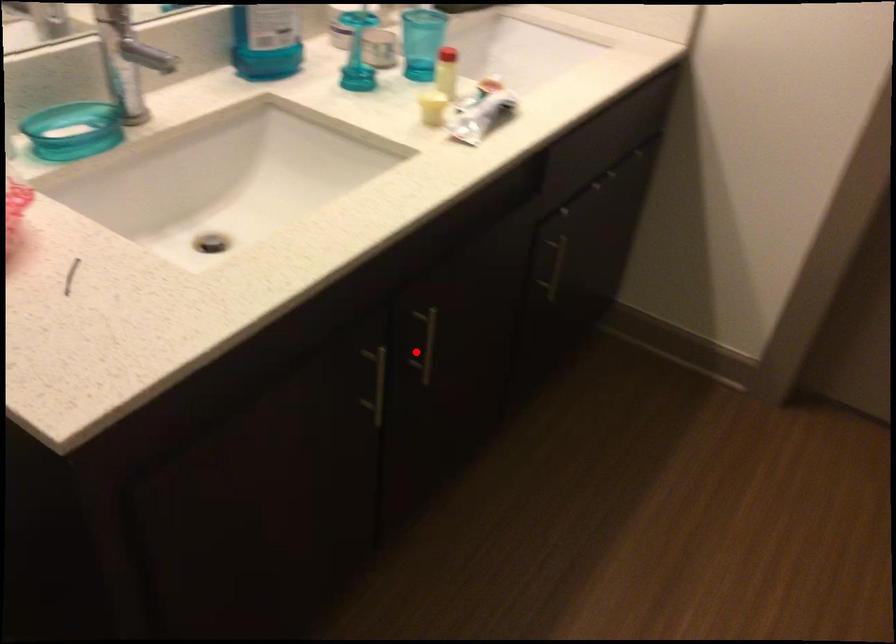
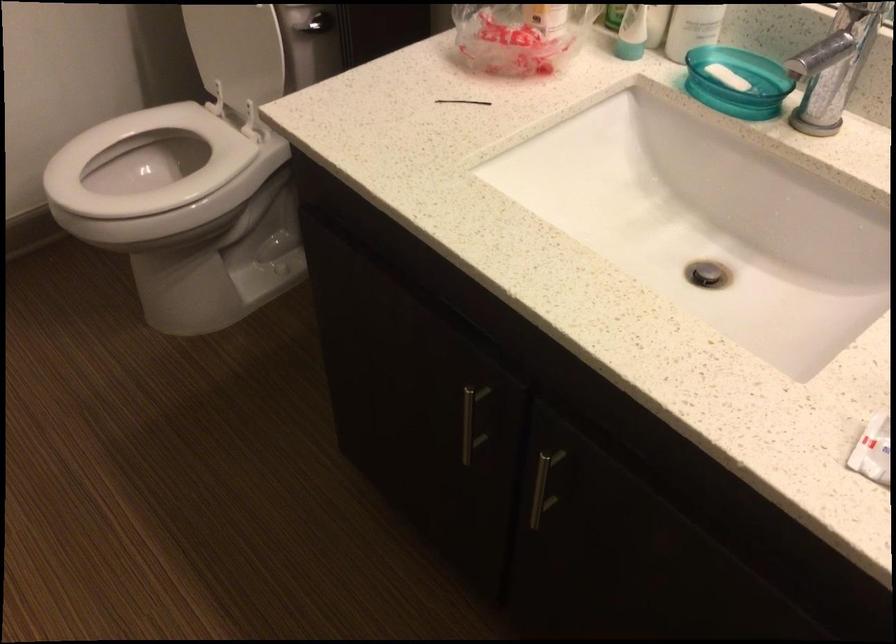
Question: I am providing you with two images of the same scene from different viewpoints. A red point is marked on the first image. Can you still see the location of the red point in image 2?

Choices:
 (A) Yes
 (B) No

Answer: (A)